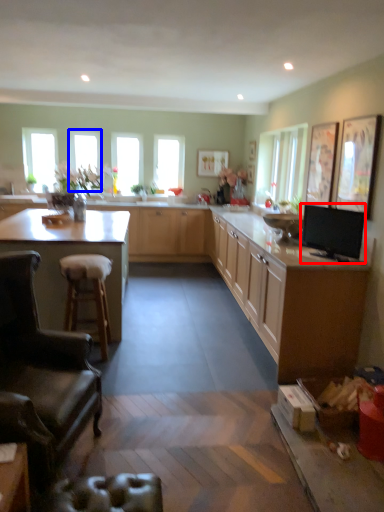
Question: Among these objects, which one is farthest to the camera, appliance (highlighted by a red box) or window (highlighted by a blue box)?

Choices:
 (A) appliance
 (B) window

Answer: (B)